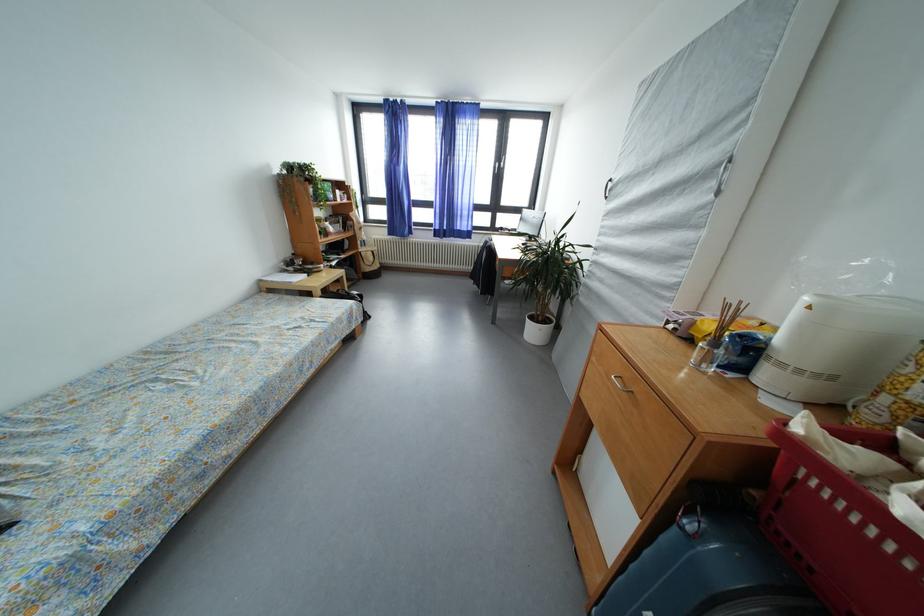
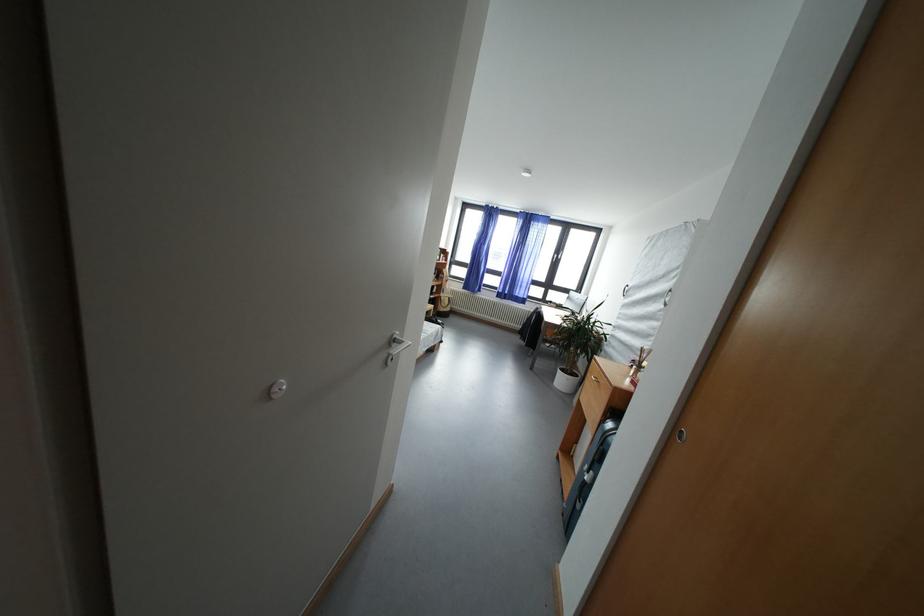
Question: What movement of the cameraman would produce the second image?

Choices:
 (A) Left
 (B) Right
 (C) Forward
 (D) Backward

Answer: (D)